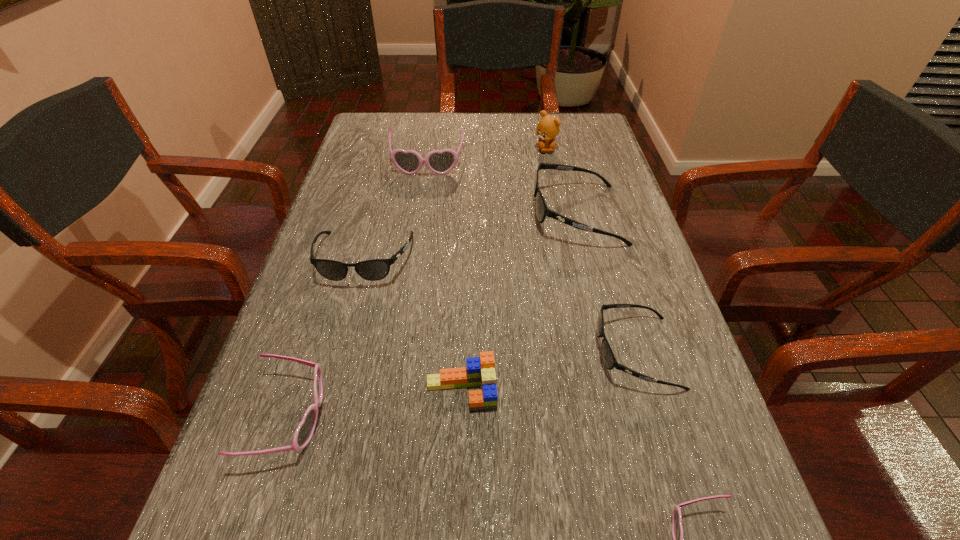
You are a GUI agent. You are given a task and a screenshot of the screen. Output one action in this format:
    pyautogui.click(x=<x>, y=<y>)
    Task: Click on the vacant space located on the front-facing side of the biggest gray sunglasses
    This screenshot has width=960, height=540.
    Given the screenshot: What is the action you would take?
    pyautogui.click(x=435, y=214)

Identify the location of vacant space situated on the front-facing side of the biggest gray sunglasses. (443, 214).

Locate an element on the screen. Image resolution: width=960 pixels, height=540 pixels. vacant space situated on the front-facing side of the biggest gray sunglasses is located at coordinates (373, 214).

At what (x,y) coordinates should I click in order to perform the action: click on free space located on the front-facing side of the farthest sunglasses. Please return your answer as a coordinate pair (x, y). Looking at the image, I should click on (417, 236).

The image size is (960, 540). What are the coordinates of `vacant space situated on the front-facing side of the second biggest gray sunglasses` in the screenshot? It's located at (340, 355).

In order to click on vacant space located on the back of the Lego in this screenshot , I will do `click(467, 244)`.

You are a GUI agent. You are given a task and a screenshot of the screen. Output one action in this format:
    pyautogui.click(x=<x>, y=<y>)
    Task: Click on the vacant area situated 0.370m on the front-facing side of the second farthest pink sunglasses
    
    Given the screenshot: What is the action you would take?
    pyautogui.click(x=554, y=417)

The width and height of the screenshot is (960, 540). In order to click on vacant space located on the front-facing side of the smallest gray sunglasses in this screenshot , I will do `click(381, 352)`.

Identify the location of vacant space located on the front-facing side of the smallest gray sunglasses. This screenshot has height=540, width=960. (497, 352).

Locate an element on the screen. vacant region located 0.120m on the front-facing side of the smallest gray sunglasses is located at coordinates (531, 352).